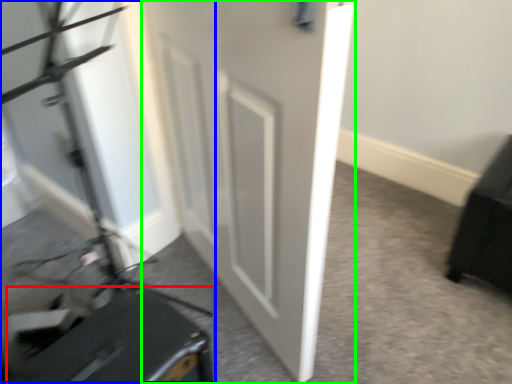
Question: Which object is the farthest from luggage (highlighted by a red box)? Choose among these: videotape (highlighted by a blue box) or door (highlighted by a green box).

Choices:
 (A) videotape
 (B) door

Answer: (B)